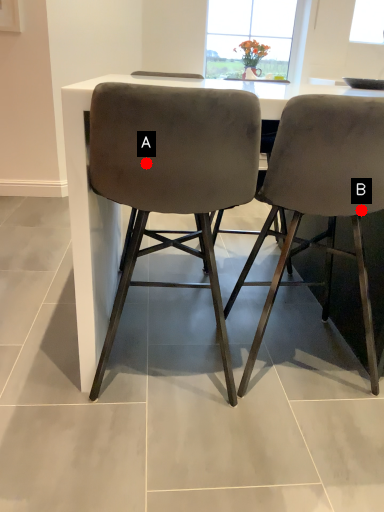
Question: Two points are circled on the image, labeled by A and B beside each circle. Which point is farther to the camera?

Choices:
 (A) A is further
 (B) B is further

Answer: (B)